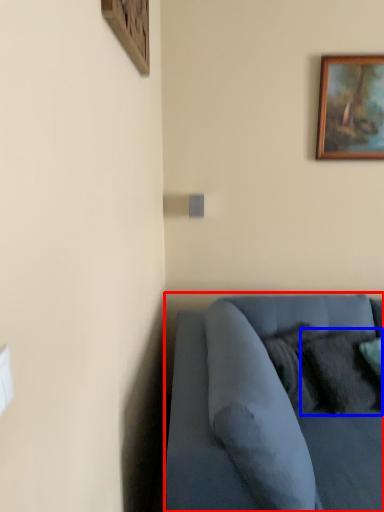
Question: Among these objects, which one is farthest to the camera, studio couch (highlighted by a red box) or pillow (highlighted by a blue box)?

Choices:
 (A) studio couch
 (B) pillow

Answer: (B)